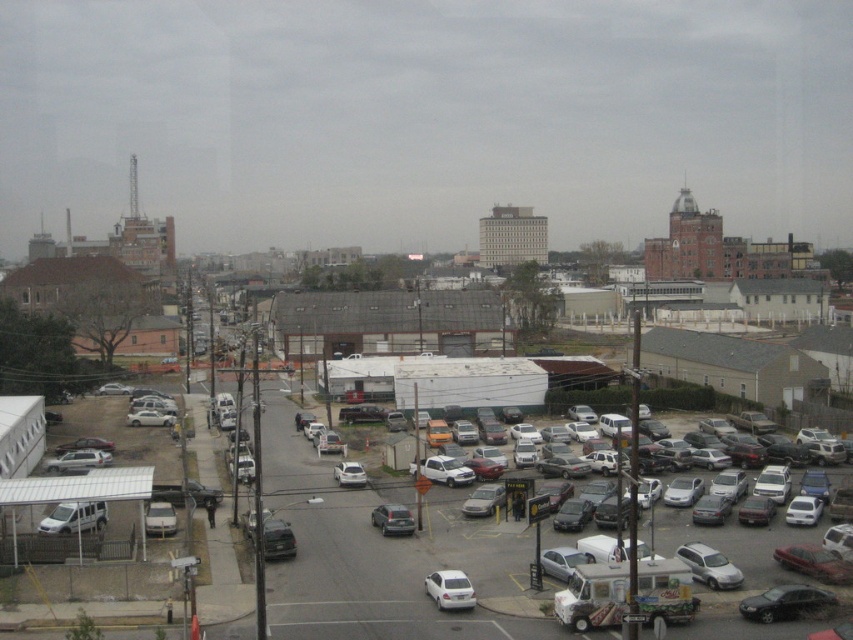
Question: Is satin silver sedan at center below white matte sedan at center?

Choices:
 (A) yes
 (B) no

Answer: (A)

Question: Which of the following is the closest to the observer?

Choices:
 (A) (689, 561)
 (B) (431, 586)
 (C) (817, 588)
 (D) (381, 524)

Answer: (B)

Question: Among these objects, which one is farthest from the camera?

Choices:
 (A) white matte car at center
 (B) matte silver van at lower left
 (C) satin silver minivan at lower right

Answer: (B)

Question: Does satin silver minivan at lower right have a larger size compared to white matte car at center?

Choices:
 (A) yes
 (B) no

Answer: (A)

Question: In this image, where is matte black sedan at lower right located relative to white matte van at lower left?

Choices:
 (A) above
 (B) below

Answer: (B)

Question: Which point is farther to the camera?

Choices:
 (A) (409, 525)
 (B) (361, 476)
 (C) (561, 600)
 (D) (164, 534)

Answer: (B)